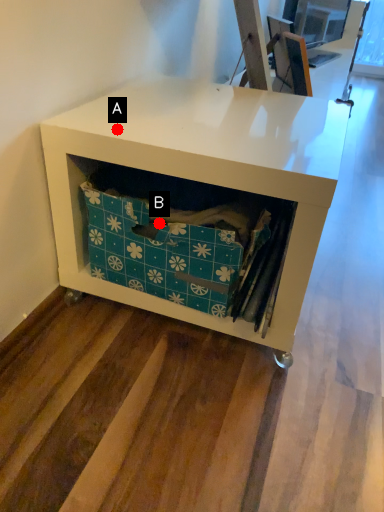
Question: Two points are circled on the image, labeled by A and B beside each circle. Among these points, which one is farthest from the camera?

Choices:
 (A) A is further
 (B) B is further

Answer: (B)